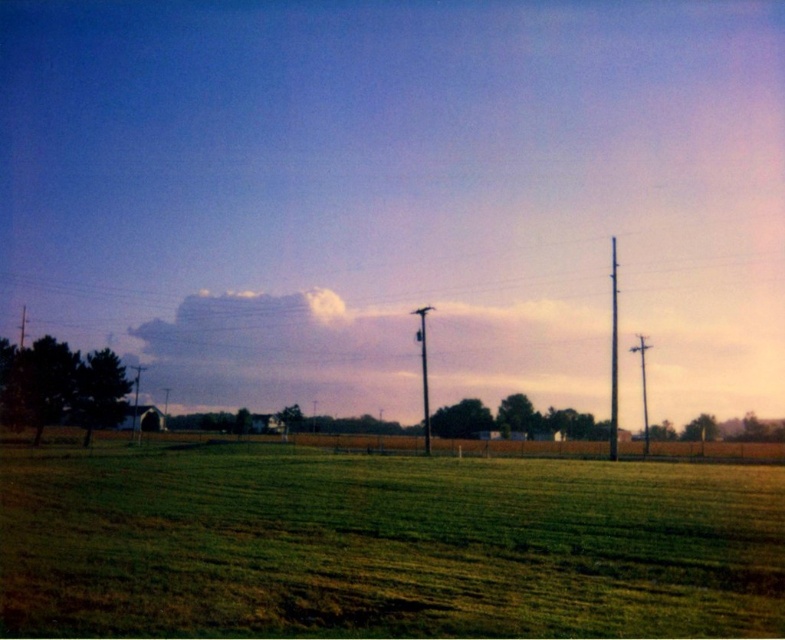
Question: Which of the following is the farthest from the observer?

Choices:
 (A) (203, 625)
 (B) (424, 408)

Answer: (B)

Question: Which of these objects is positioned closest to the metallic gray pole at right?

Choices:
 (A) green grassy field at center
 (B) smooth metallic pole at center

Answer: (A)

Question: Can you confirm if green grassy field at center is positioned to the right of smooth metallic pole at center?

Choices:
 (A) no
 (B) yes

Answer: (A)

Question: Which object is closer to the camera taking this photo?

Choices:
 (A) metallic gray pole at right
 (B) smooth metallic pole at center
 (C) green grassy field at center

Answer: (C)

Question: Is green grassy field at center closer to the viewer compared to smooth metallic pole at center?

Choices:
 (A) no
 (B) yes

Answer: (B)

Question: Does green grassy field at center have a lesser width compared to smooth metallic pole at center?

Choices:
 (A) yes
 (B) no

Answer: (B)